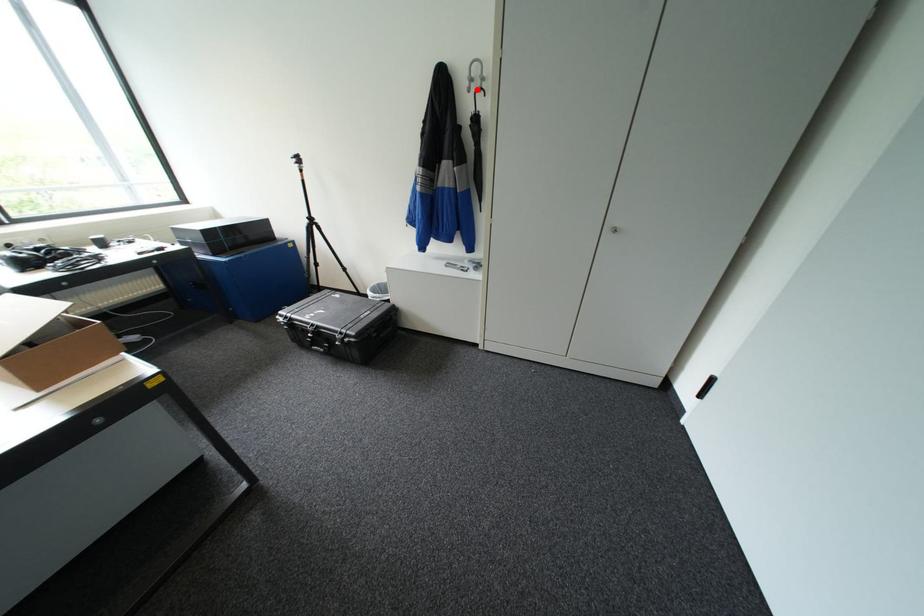
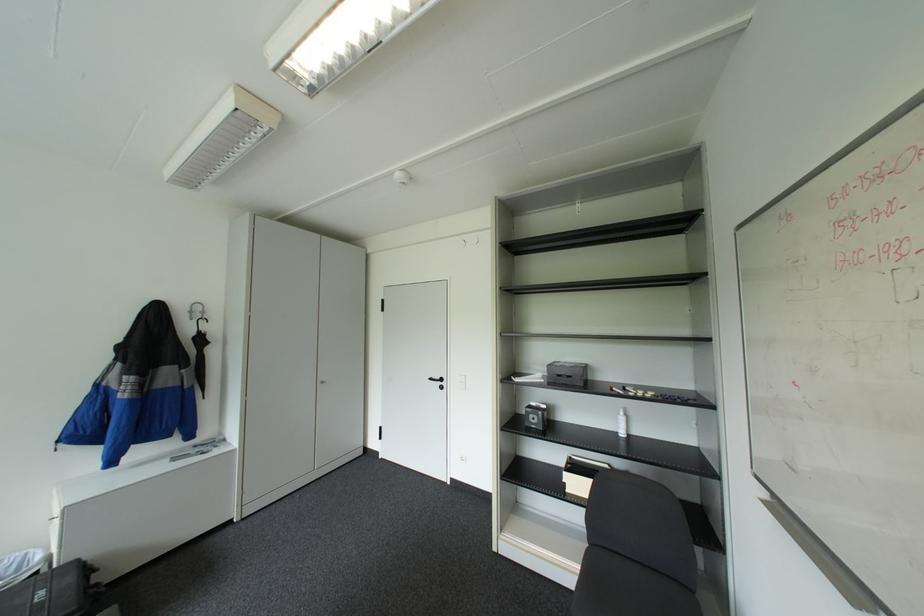
Where in the second image is the point corresponding to the highlighted location from the first image?

(200, 318)